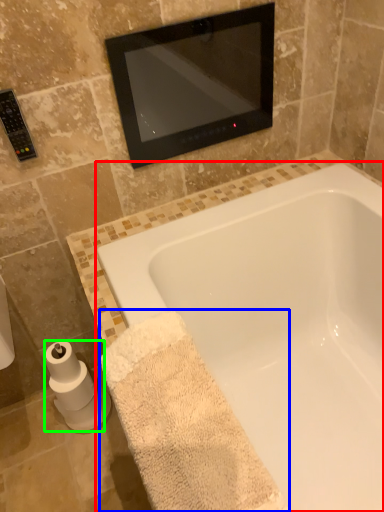
Question: Which object is positioned closest to bathtub (highlighted by a red box)? Select from bath towel (highlighted by a blue box) and toilet paper (highlighted by a green box).

Choices:
 (A) bath towel
 (B) toilet paper

Answer: (A)